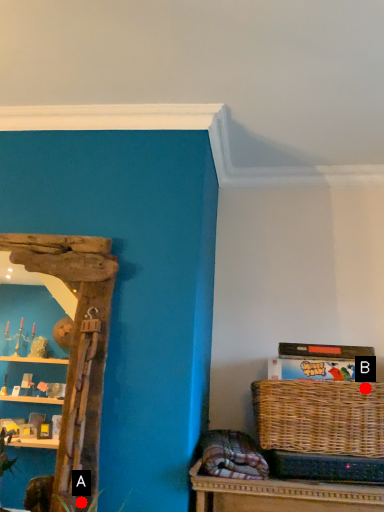
Question: Two points are circled on the image, labeled by A and B beside each circle. Which point is further to the camera?

Choices:
 (A) A is further
 (B) B is further

Answer: (B)